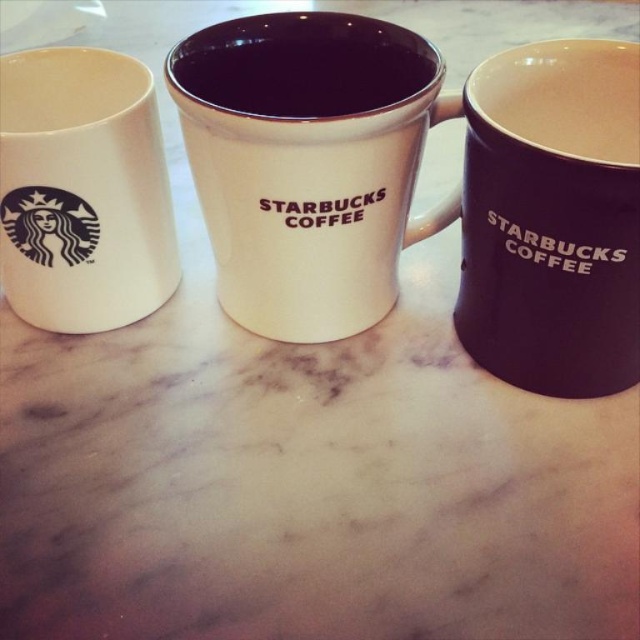
Consider the image. You are trying to place a 5 inch ruler between the white glossy mug at center and the matte ceramic mug at center. Will the ruler fit between them?

The distance between the white glossy mug at center and the matte ceramic mug at center is 4.60 inches. Since the ruler is 5 inches long, it will not fit between them as the space is slightly smaller than the ruler.

Based on the photo, you are a barista arranging mugs on a marble countertop. You have a white glossy mug at center and a matte ceramic mug at center. According to the arrangement, which mug is positioned higher up?

The matte ceramic mug at center is positioned higher up since the white glossy mug at center is located below it.